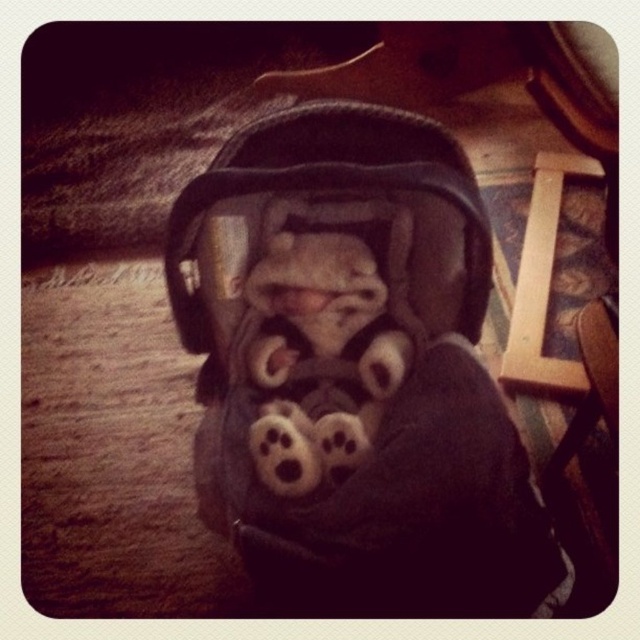
Which is behind, point (388, 241) or point (324, 346)?

The point (324, 346) is behind.

Does point (205, 340) come behind point (339, 328)?

Yes.

Which is behind, point (330, 413) or point (358, 454)?

Point (330, 413)

Identify the location of dark gray fabric baby carriage at center. (355, 371).